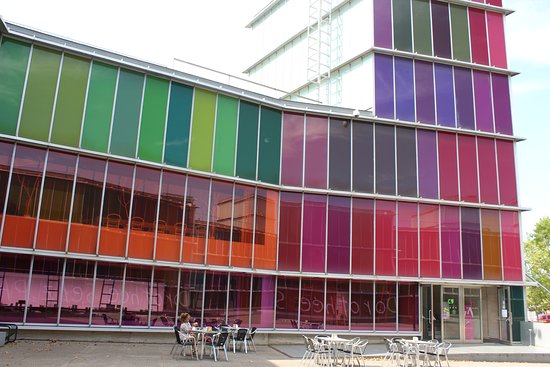
Locate an element on the screen. This screenshot has width=550, height=367. green windows is located at coordinates (16, 79), (38, 91), (96, 107), (150, 119), (228, 136).